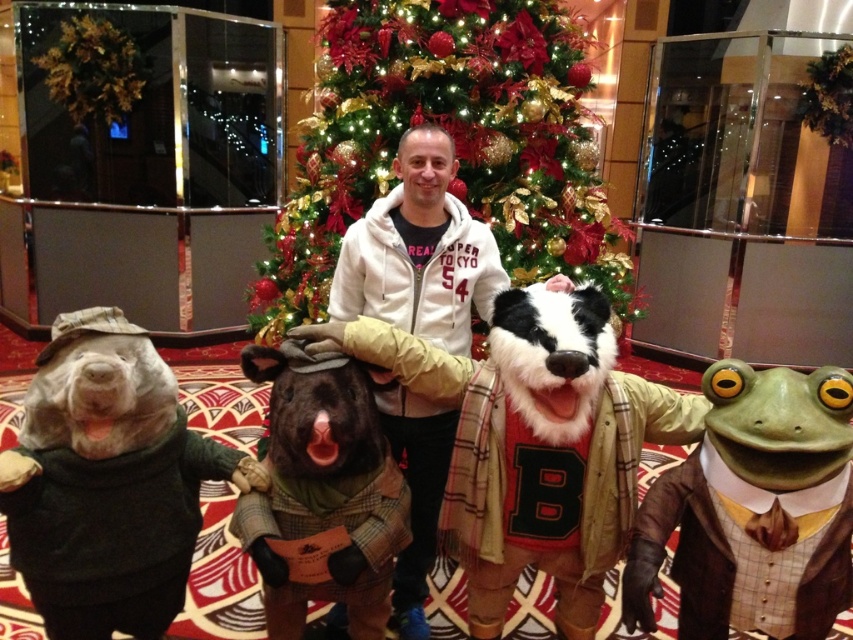
The image size is (853, 640). In order to click on green shiny christmas tree at center in this screenshot , I will do `click(453, 141)`.

Who is higher up, green shiny christmas tree at center or white fleece hoodie at center?

green shiny christmas tree at center

Between point (460, 157) and point (408, 576), which one is positioned in front?

Positioned in front is point (408, 576).

Locate an element on the screen. The height and width of the screenshot is (640, 853). green shiny christmas tree at center is located at coordinates (453, 141).

Which of these two, fuzzy beige badger at center or white fleece hoodie at center, stands shorter?

With less height is fuzzy beige badger at center.

Is point (560, 554) more distant than point (428, 483)?

No, (560, 554) is closer to viewer.

This screenshot has height=640, width=853. What are the coordinates of `fuzzy beige badger at center` in the screenshot? It's located at (532, 435).

Based on the photo, is fuzzy beige badger at center below green fabric frog at right?

No, fuzzy beige badger at center is not below green fabric frog at right.

Is fuzzy beige badger at center bigger than green fabric frog at right?

Yes.

Is point (631, 499) less distant than point (635, 573)?

No, it is not.

Where is `fuzzy beige badger at center`? This screenshot has width=853, height=640. fuzzy beige badger at center is located at coordinates (532, 435).